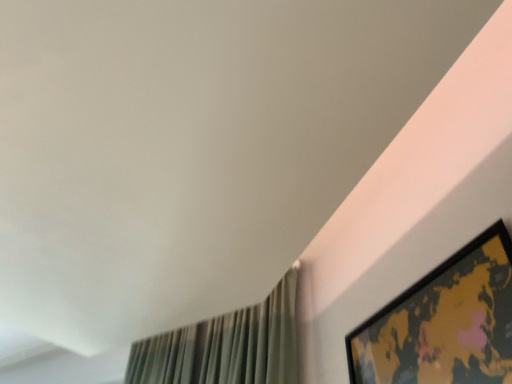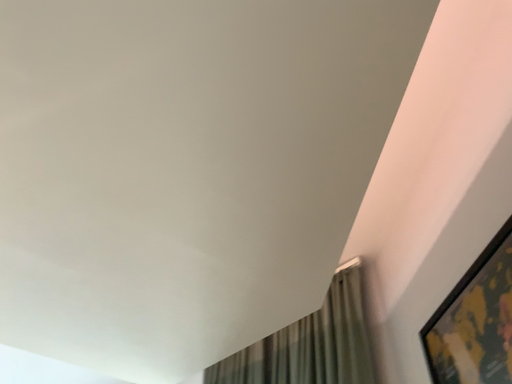
Question: How did the camera likely rotate when shooting the video?

Choices:
 (A) rotated right
 (B) rotated left

Answer: (B)